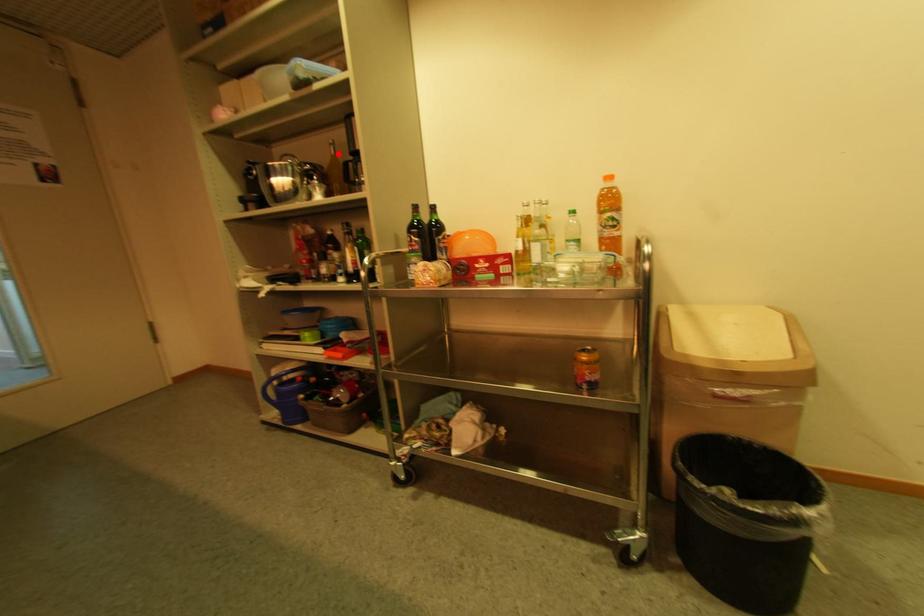
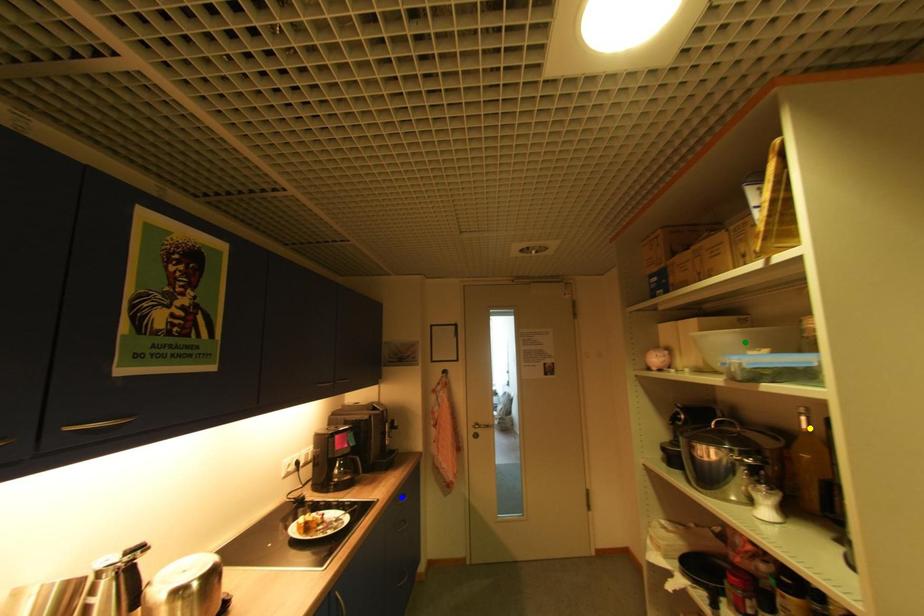
Question: I am providing you with two images of the same scene from different viewpoints. A red point is marked on the first image. You are given multiple points on the second image. Which point in image 2 is actually the same real-world point as the red point in image 1?

Choices:
 (A) yellow point
 (B) green point
 (C) blue point

Answer: (A)